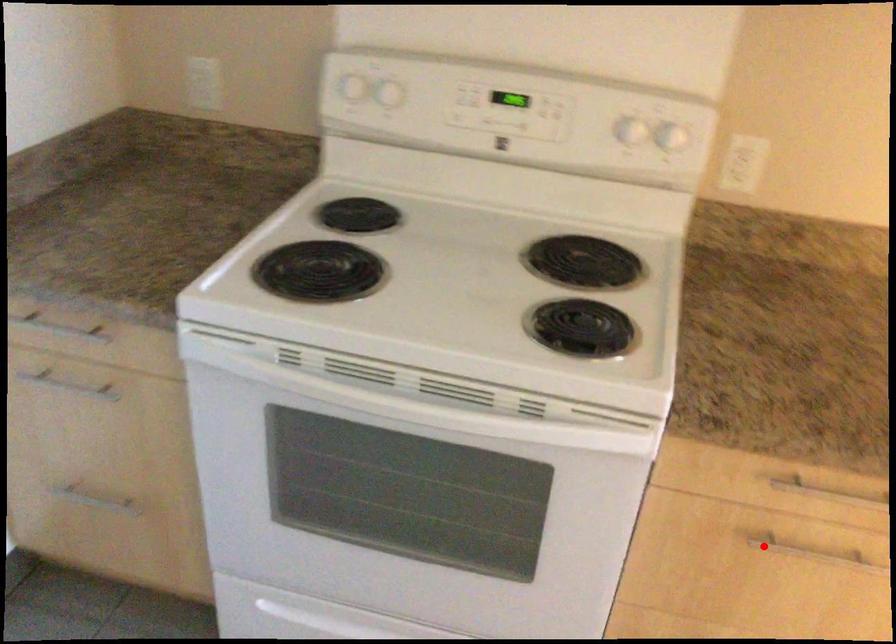
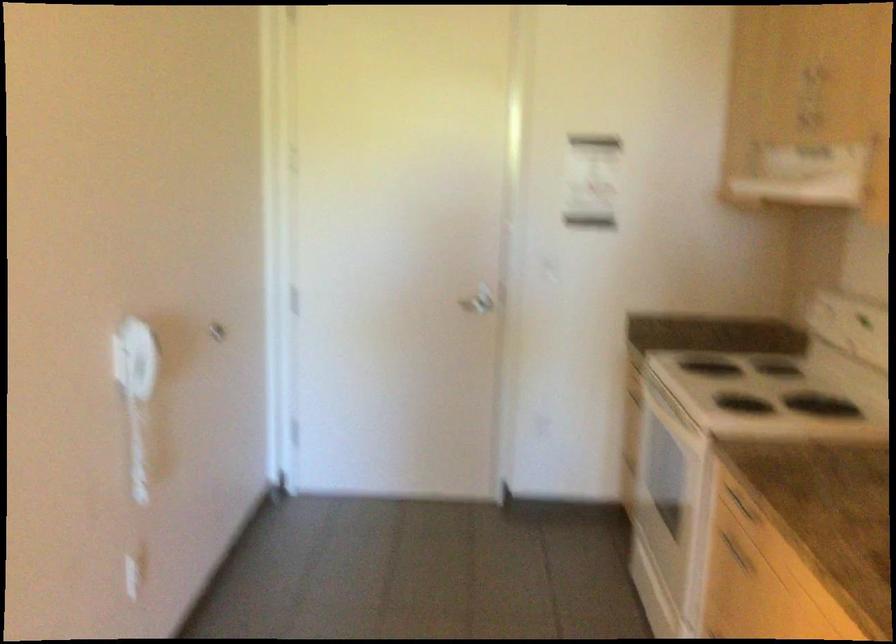
Where in the second image is the point corresponding to the highlighted location from the first image?

(735, 552)